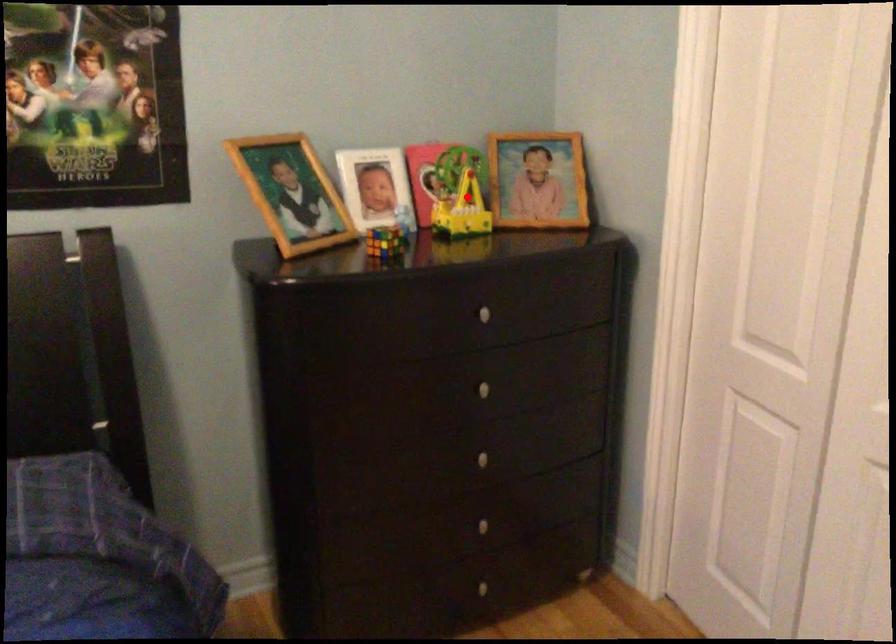
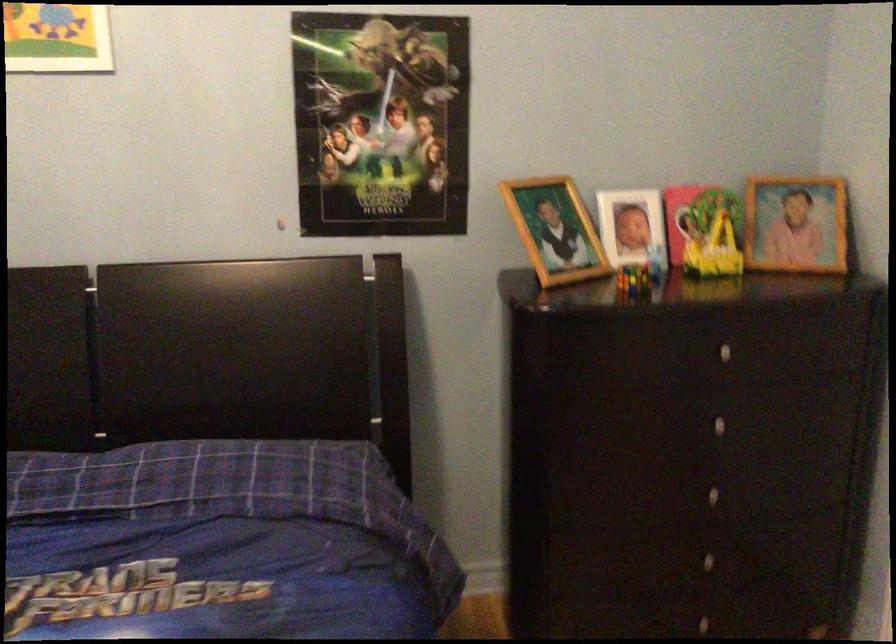
Find the pixel in the second image that matches the highlighted location in the first image.

(719, 240)